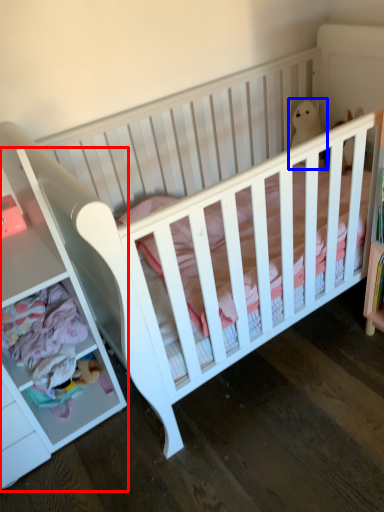
Question: Which point is further to the camera, dresser (highlighted by a red box) or animal (highlighted by a blue box)?

Choices:
 (A) dresser
 (B) animal

Answer: (B)